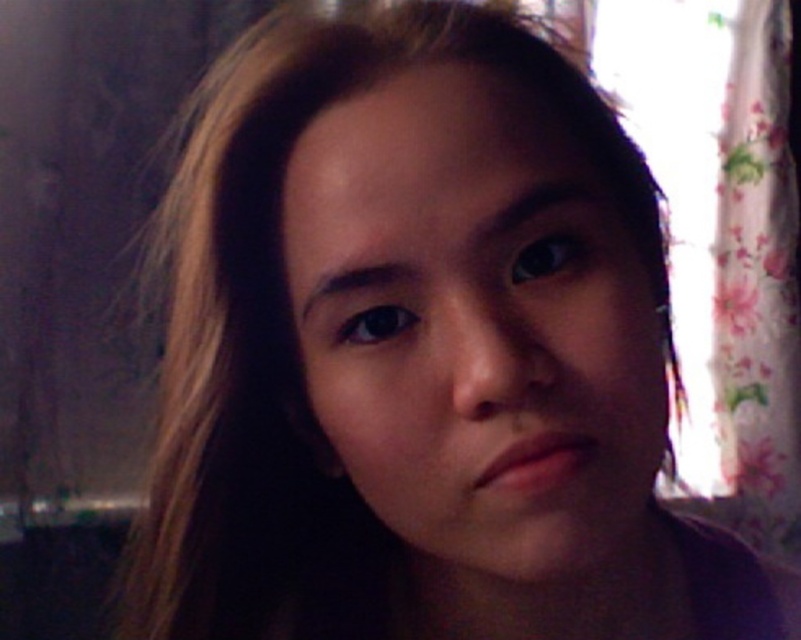
What do you see at coordinates (475, 324) in the screenshot? This screenshot has height=640, width=801. I see `smooth skin face at center` at bounding box center [475, 324].

Is point (636, 536) positioned after point (767, 550)?

No, (636, 536) is closer to viewer.

You are a GUI agent. You are given a task and a screenshot of the screen. Output one action in this format:
    pyautogui.click(x=<x>, y=<y>)
    Task: Click on the smooth skin face at center
    Image resolution: width=801 pixels, height=640 pixels.
    Given the screenshot: What is the action you would take?
    pyautogui.click(x=475, y=324)